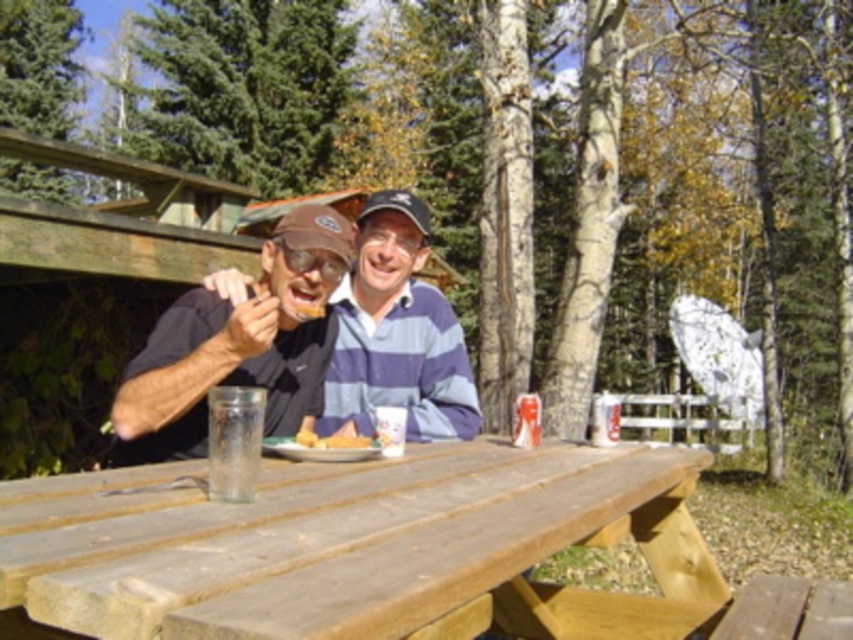
You are a food delivery robot that needs to place a new order of golden fried chicken at center onto the wooden picnic table at center. The robot has a maximum reach of 50 centimeters. Can you safely place the chicken on the table without moving?

The wooden picnic table at center and golden fried chicken at center are 53.97 centimeters apart from each other. Since the robot can only reach 50 centimeters, it cannot safely place the chicken on the table without moving closer or adjusting its position.

You are standing in front of a wooden picnic table at center and want to place a 24 inch long object on it. Will it fit on the table?

The wooden picnic table at center is 28.88 inches from camera, so the 24 inch long object will fit on it since it is shorter than the table length.

You are standing in front of the wooden picnic table at center and want to pick up the matte black shirt at center. Is the shirt within your immediate reach without moving the table?

The wooden picnic table at center is closer to the viewer than the matte black shirt at center, so the shirt is farther away. You would need to move closer or the table might be blocking access.